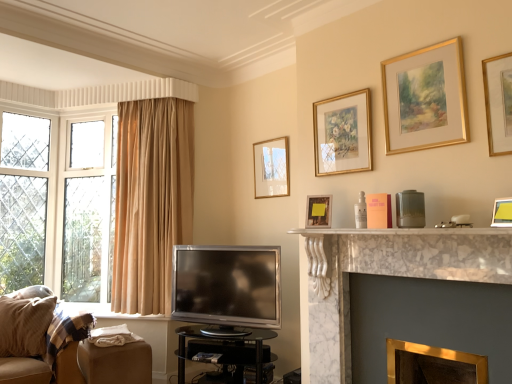
Image resolution: width=512 pixels, height=384 pixels. Describe the element at coordinates (498, 103) in the screenshot. I see `gold-framed picture at upper right, placed as the 2th picture frame when sorted from front to back` at that location.

The width and height of the screenshot is (512, 384). Find the location of `matte gold picture frame at upper center, the second picture frame viewed from the left`. matte gold picture frame at upper center, the second picture frame viewed from the left is located at coordinates (318, 211).

Looking at this image, how different are the orientations of satin silver television at lower center and brown leather footrest at lower left in degrees?

The facing directions of satin silver television at lower center and brown leather footrest at lower left are 59.4 degrees apart.

Does point (210, 271) come in front of point (135, 370)?

No, (210, 271) is further to viewer.

Considering the relative sizes of satin silver television at lower center and brown leather footrest at lower left in the image provided, is satin silver television at lower center bigger than brown leather footrest at lower left?

Yes.

Does satin silver television at lower center come behind brown leather footrest at lower left?

That is True.

Find the location of a particular element. The height and width of the screenshot is (384, 512). studio couch that appears on the left of beige fabric window sill at lower left is located at coordinates (25, 338).

From the image's perspective, between beige fabric couch at lower left and beige fabric window sill at lower left, who is located below?

beige fabric couch at lower left.

Is beige fabric couch at lower left beside beige fabric window sill at lower left?

No, beige fabric couch at lower left is not touching beige fabric window sill at lower left.

Considering the sizes of objects satin silver television at lower center and transparent glass table at center in the image provided, who is wider, satin silver television at lower center or transparent glass table at center?

transparent glass table at center.

Can you see satin silver television at lower center touching transparent glass table at center?

No, satin silver television at lower center is not beside transparent glass table at center.

From the image's perspective, does satin silver television at lower center appear lower than transparent glass table at center?

Incorrect, from the image's perspective, satin silver television at lower center is higher than transparent glass table at center.

Identify the location of television that is behind the transparent glass table at center. (227, 285).

Where is `the 1st fireplace in front of the corduroy pillow at lower left, counting from the anchor's position`? the 1st fireplace in front of the corduroy pillow at lower left, counting from the anchor's position is located at coordinates pyautogui.click(x=433, y=365).

Considering the sizes of objects gold metallic fireplace at lower right, positioned as the first fireplace in bottom-to-top order, and corduroy pillow at lower left in the image provided, who is wider, gold metallic fireplace at lower right, positioned as the first fireplace in bottom-to-top order, or corduroy pillow at lower left?

corduroy pillow at lower left is wider.

Between gold metallic fireplace at lower right, positioned as the first fireplace in bottom-to-top order, and corduroy pillow at lower left, which one has larger size?

corduroy pillow at lower left.

Can you confirm if gold metallic fireplace at lower right, which appears as the second fireplace when viewed from the top, is shorter than corduroy pillow at lower left?

Indeed, gold metallic fireplace at lower right, which appears as the second fireplace when viewed from the top, has a lesser height compared to corduroy pillow at lower left.

How much distance is there between white marble fireplace at upper center and corduroy pillow at lower left?

white marble fireplace at upper center is 2.01 meters from corduroy pillow at lower left.

Can you confirm if white marble fireplace at upper center is bigger than corduroy pillow at lower left?

Actually, white marble fireplace at upper center might be smaller than corduroy pillow at lower left.

Does white marble fireplace at upper center have a lesser height compared to corduroy pillow at lower left?

Yes.

Is white marble fireplace at upper center positioned before gold metallic fireplace at lower right, which appears as the second fireplace when viewed from the top?

Yes, it is.

Can you confirm if white marble fireplace at upper center is positioned to the right of gold metallic fireplace at lower right, positioned as the first fireplace in bottom-to-top order?

Incorrect, white marble fireplace at upper center is not on the right side of gold metallic fireplace at lower right, positioned as the first fireplace in bottom-to-top order.

Is white marble fireplace at upper center placed right next to gold metallic fireplace at lower right, which appears as the second fireplace when viewed from the top?

They are not placed beside each other.

From a real-world perspective, is white marble fireplace at upper center below gold metallic fireplace at lower right, positioned as the first fireplace in bottom-to-top order?

No, from a real-world perspective, white marble fireplace at upper center is not beneath gold metallic fireplace at lower right, positioned as the first fireplace in bottom-to-top order.

Is gold metallic fireplace at lower right, positioned as the first fireplace in bottom-to-top order, oriented towards matte gold picture frame at upper center, arranged as the 2th picture frame when viewed from the back?

No.

From the image's perspective, who appears lower, gold metallic fireplace at lower right, positioned as the first fireplace in bottom-to-top order, or matte gold picture frame at upper center, placed as the 5th picture frame when sorted from right to left?

From the image's view, gold metallic fireplace at lower right, positioned as the first fireplace in bottom-to-top order, is below.

Which of these two, gold metallic fireplace at lower right, which appears as the second fireplace when viewed from the top, or matte gold picture frame at upper center, the fifth picture frame from the front, is smaller?

With smaller size is matte gold picture frame at upper center, the fifth picture frame from the front.

Starting from the matte gold picture frame at upper center, the second picture frame viewed from the left, which fireplace is the 1st one in front? Please provide its 2D coordinates.

[(433, 365)]

This screenshot has width=512, height=384. I want to click on television above the brown leather footrest at lower left (from a real-world perspective), so click(x=227, y=285).

What are the coordinates of `window sill on the right of beige fabric couch at lower left` in the screenshot? It's located at (110, 312).

From the image, which object appears to be farther from white marble fireplace at center, arranged as the second fireplace when ordered from the bottom, gold-framed painting at upper center, which is the fourth picture frame from right to left, or satin silver television at lower center?

satin silver television at lower center lies further to white marble fireplace at center, arranged as the second fireplace when ordered from the bottom, than the other object.

Estimate the real-world distances between objects in this image. Which object is closer to transparent glass table at center, corduroy pillow at lower left or satin silver television at lower center?

satin silver television at lower center is positioned closer to the anchor transparent glass table at center.

Which object lies further to the anchor point satin silver television at lower center, matte gold picture frame at upper center, the second picture frame viewed from the left, or white marble fireplace at upper center?

matte gold picture frame at upper center, the second picture frame viewed from the left.

Estimate the real-world distances between objects in this image. Which object is closer to brown leather footrest at lower left, satin silver television at lower center or beige fabric couch at lower left?

beige fabric couch at lower left is closer to brown leather footrest at lower left.

Based on their spatial positions, is white marble fireplace at upper center or brown leather footrest at lower left further from corduroy pillow at lower left?

white marble fireplace at upper center is further to corduroy pillow at lower left.

Considering their positions, is white marble fireplace at center, arranged as the second fireplace when ordered from the bottom, positioned closer to beige fabric couch at lower left than gold-framed painting at upper right, the fourth picture frame viewed from the back?

white marble fireplace at center, arranged as the second fireplace when ordered from the bottom, is closer to beige fabric couch at lower left.

When comparing their distances from beige fabric window sill at lower left, does gold-framed painting at upper center, which is the 4th picture frame from front to back, or gold-framed picture at upper right, placed as the 2th picture frame when sorted from front to back, seem further?

The object further to beige fabric window sill at lower left is gold-framed picture at upper right, placed as the 2th picture frame when sorted from front to back.

Which object lies further to the anchor point gold metallic fireplace at lower right, which appears as the second fireplace when viewed from the top, gold-framed painting at upper center, the third picture frame in the back-to-front sequence, or white marble fireplace at center, the 1th fireplace in the top-to-bottom sequence?

Based on the image, gold-framed painting at upper center, the third picture frame in the back-to-front sequence, appears to be further to gold metallic fireplace at lower right, which appears as the second fireplace when viewed from the top.

Locate an element on the screen. This screenshot has width=512, height=384. window sill between beige fabric couch at lower left and transparent glass table at center is located at coordinates (110, 312).

I want to click on table between corduroy pillow at lower left and white marble fireplace at upper center in the horizontal direction, so click(x=225, y=352).

You are a GUI agent. You are given a task and a screenshot of the screen. Output one action in this format:
    pyautogui.click(x=<x>, y=<y>)
    Task: Click on the television positioned between gold-framed picture at upper right, placed as the 2th picture frame when sorted from front to back, and matte gold picture frame at upper center, acting as the sixth picture frame starting from the front, from near to far
    
    Given the screenshot: What is the action you would take?
    [227, 285]

At what (x,y) coordinates should I click in order to perform the action: click on pillow between beige fabric couch at lower left and beige fabric window sill at lower left from front to back. Please return your answer as a coordinate pair (x, y). The height and width of the screenshot is (384, 512). Looking at the image, I should click on pos(25,325).